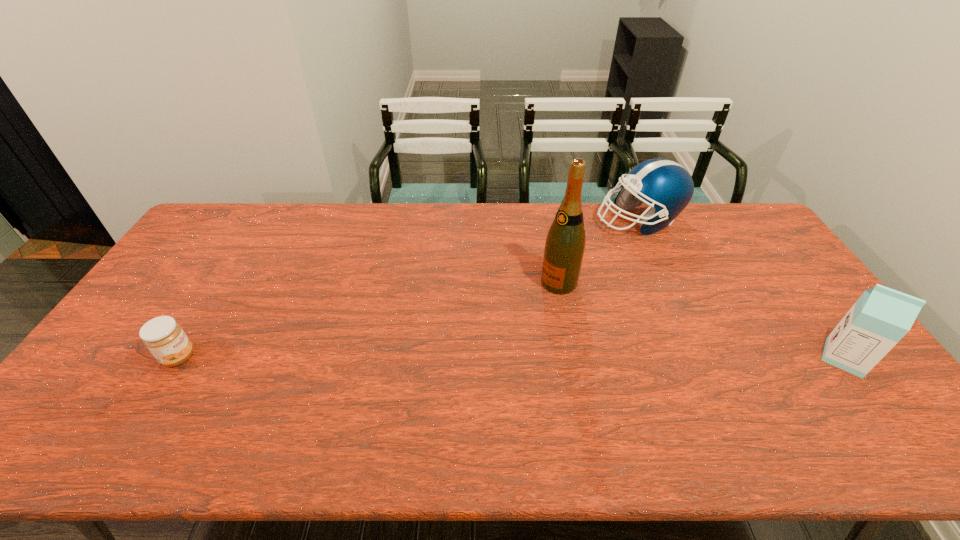
Image resolution: width=960 pixels, height=540 pixels. In order to click on jam in this screenshot , I will do `click(163, 336)`.

Where is `the shortest object`? This screenshot has width=960, height=540. the shortest object is located at coordinates (163, 336).

Find the location of a particular element. the rightmost object is located at coordinates (881, 317).

I want to click on the second object from left to right, so click(x=565, y=243).

Locate an element on the screen. the third nearest object is located at coordinates (565, 243).

The height and width of the screenshot is (540, 960). Find the location of `the third object from left to right`. the third object from left to right is located at coordinates (665, 185).

At what (x,y) coordinates should I click in order to perform the action: click on the farthest object. Please return your answer as a coordinate pair (x, y). The height and width of the screenshot is (540, 960). Looking at the image, I should click on [665, 185].

You are a GUI agent. You are given a task and a screenshot of the screen. Output one action in this format:
    pyautogui.click(x=<x>, y=<y>)
    Task: Click on the blank area located 0.100m on the front label of the leftmost object
    
    Given the screenshot: What is the action you would take?
    [232, 357]

Where is `vacant area situated on the left of the milk carton`? vacant area situated on the left of the milk carton is located at coordinates (680, 357).

You are a GUI agent. You are given a task and a screenshot of the screen. Output one action in this format:
    pyautogui.click(x=<x>, y=<y>)
    Task: Click on the vacant space located on the front-facing side of the tallest object
    This screenshot has height=540, width=960.
    Given the screenshot: What is the action you would take?
    pyautogui.click(x=488, y=330)